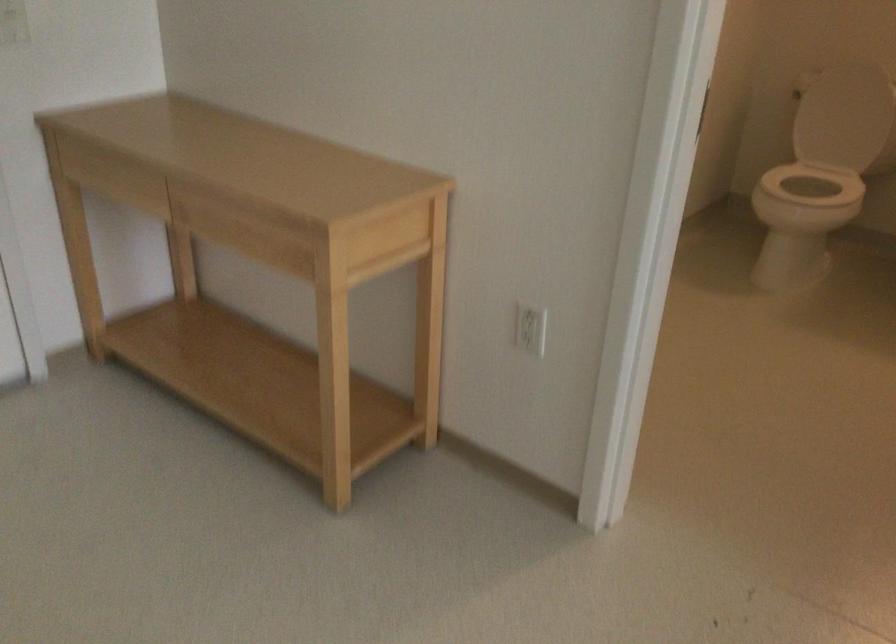
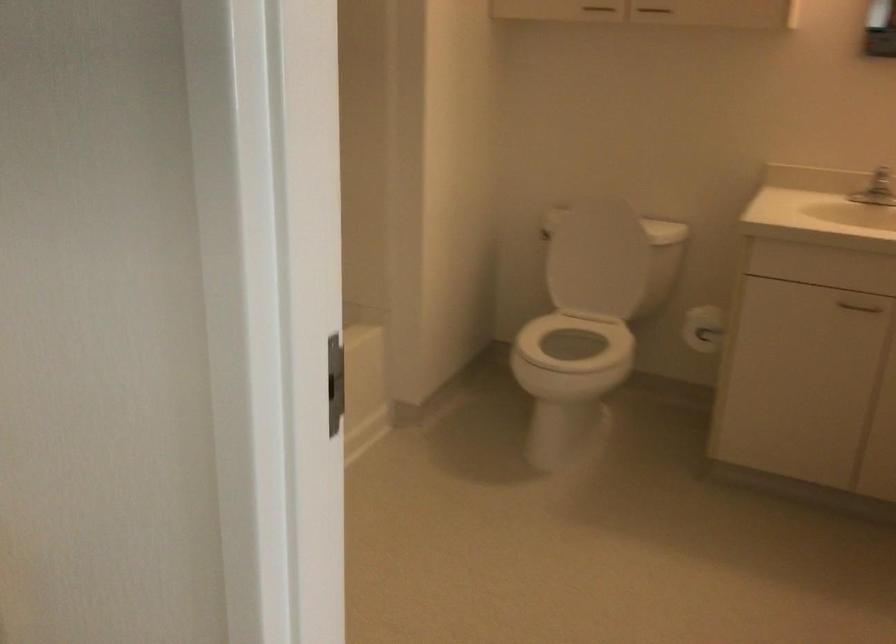
In a continuous first-person perspective shot, in which direction is the camera moving?

The cameraman moved toward right, forward.